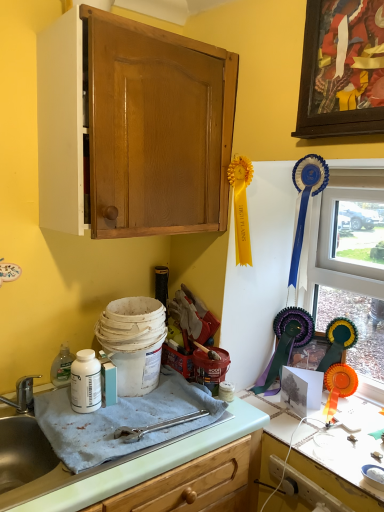
Locate an element on the screen. The height and width of the screenshot is (512, 384). blue ribbon at upper right is located at coordinates (306, 200).

Describe the element at coordinates (334, 470) in the screenshot. This screenshot has height=512, width=384. I see `white glossy countertop at lower right, which appears as the second countertop when viewed from the left` at that location.

What are the coordinates of `clear glass window at right` in the screenshot? It's located at (352, 267).

How distant is wooden picture frame at upper right from light green laminate countertop at lower center, which appears as the second countertop when viewed from the right?

A distance of 1.03 meters exists between wooden picture frame at upper right and light green laminate countertop at lower center, which appears as the second countertop when viewed from the right.

Is wooden picture frame at upper right facing away from light green laminate countertop at lower center, which appears as the second countertop when viewed from the right?

No, wooden picture frame at upper right's orientation is not away from light green laminate countertop at lower center, which appears as the second countertop when viewed from the right.

Considering the points (354, 90) and (123, 473), which point is in front, point (354, 90) or point (123, 473)?

The point (123, 473) is closer to the camera.

Is wooden picture frame at upper right at the right side of light green laminate countertop at lower center, marked as the 1th countertop in a left-to-right arrangement?

Yes, wooden picture frame at upper right is to the right of light green laminate countertop at lower center, marked as the 1th countertop in a left-to-right arrangement.

Is white matte bottle at lower left at the back of white glossy countertop at lower right, which appears as the second countertop when viewed from the left?

white glossy countertop at lower right, which appears as the second countertop when viewed from the left, does not have its back to white matte bottle at lower left.

Considering the sizes of objects white glossy countertop at lower right, which appears as the second countertop when viewed from the left, and white matte bottle at lower left in the image provided, who is bigger, white glossy countertop at lower right, which appears as the second countertop when viewed from the left, or white matte bottle at lower left?

With larger size is white glossy countertop at lower right, which appears as the second countertop when viewed from the left.

This screenshot has height=512, width=384. I want to click on the 2nd countertop located beneath the white matte bottle at lower left (from a real-world perspective), so click(334, 470).

From the image's perspective, relative to blue ribbon at upper right, is light green laminate countertop at lower center, marked as the 1th countertop in a left-to-right arrangement, above or below?

From the image's perspective, light green laminate countertop at lower center, marked as the 1th countertop in a left-to-right arrangement, appears below blue ribbon at upper right.

Based on the photo, is light green laminate countertop at lower center, which appears as the second countertop when viewed from the right, at the right side of blue ribbon at upper right?

No.

Can you tell me how much light green laminate countertop at lower center, marked as the 1th countertop in a left-to-right arrangement, and blue ribbon at upper right differ in facing direction?

86.7 degrees.

Which is closer, (126, 488) or (298, 183)?

Point (126, 488) appears to be closer to the viewer than point (298, 183).

Where is `brush above the light green laminate countertop at lower center, marked as the 1th countertop in a left-to-right arrangement (from a real-world perspective)`? The image size is (384, 512). brush above the light green laminate countertop at lower center, marked as the 1th countertop in a left-to-right arrangement (from a real-world perspective) is located at coordinates (306, 200).

Can you confirm if blue ribbon at upper right is taller than light green laminate countertop at lower center, marked as the 1th countertop in a left-to-right arrangement?

Yes.

Which point is more forward, (323, 178) or (158, 455)?

Positioned in front is point (158, 455).

The height and width of the screenshot is (512, 384). I want to click on cabinetry on the left of clear glass window at right, so click(133, 128).

Can you confirm if clear glass window at right is taller than matte wood cabinet at upper left?

Indeed, clear glass window at right has a greater height compared to matte wood cabinet at upper left.

Between clear glass window at right and matte wood cabinet at upper left, which one has larger width?

Wider between the two is matte wood cabinet at upper left.

Considering the sizes of objects clear glass window at right and matte wood cabinet at upper left in the image provided, who is smaller, clear glass window at right or matte wood cabinet at upper left?

clear glass window at right is smaller.

Consider the image. Which object is further away from the camera taking this photo, white matte bottle at lower left or matte wood cabinet at upper left?

white matte bottle at lower left is more distant.

From the image's perspective, which one is positioned higher, white matte bottle at lower left or matte wood cabinet at upper left?

From the image's view, matte wood cabinet at upper left is above.

From a real-world perspective, who is located higher, white matte bottle at lower left or matte wood cabinet at upper left?

matte wood cabinet at upper left.

Is light green laminate countertop at lower center, marked as the 1th countertop in a left-to-right arrangement, inside the boundaries of white glossy countertop at lower right, which appears as the second countertop when viewed from the left, or outside?

light green laminate countertop at lower center, marked as the 1th countertop in a left-to-right arrangement, lies outside white glossy countertop at lower right, which appears as the second countertop when viewed from the left.

Could you tell me if light green laminate countertop at lower center, marked as the 1th countertop in a left-to-right arrangement, is turned towards white glossy countertop at lower right, positioned as the first countertop in right-to-left order?

No, light green laminate countertop at lower center, marked as the 1th countertop in a left-to-right arrangement, does not turn towards white glossy countertop at lower right, positioned as the first countertop in right-to-left order.

Between point (11, 413) and point (358, 468), which one is positioned behind?

The point (11, 413) is more distant.

Is light green laminate countertop at lower center, marked as the 1th countertop in a left-to-right arrangement, in front of or behind white glossy countertop at lower right, positioned as the first countertop in right-to-left order, in the image?

light green laminate countertop at lower center, marked as the 1th countertop in a left-to-right arrangement, is positioned closer to the viewer than white glossy countertop at lower right, positioned as the first countertop in right-to-left order.

This screenshot has height=512, width=384. There is a wooden picture frame at upper right. Identify the location of the 1st countertop below it (from the image's perspective). (137, 465).

I want to click on bottle behind the white glossy countertop at lower right, positioned as the first countertop in right-to-left order, so click(x=86, y=382).

Looking at this image, which object lies nearer to the anchor point blue ribbon at upper right, wooden picture frame at upper right or clear glass window at right?

wooden picture frame at upper right.

Considering their positions, is white matte bottle at lower left positioned closer to blue ribbon at upper right than clear glass window at right?

clear glass window at right is closer to blue ribbon at upper right.

Estimate the real-world distances between objects in this image. Which object is closer to wooden picture frame at upper right, blue ribbon at upper right or white glossy countertop at lower right, which appears as the second countertop when viewed from the left?

Among the two, blue ribbon at upper right is located nearer to wooden picture frame at upper right.

Which object lies nearer to the anchor point clear glass window at right, light green laminate countertop at lower center, which appears as the second countertop when viewed from the right, or white glossy countertop at lower right, which appears as the second countertop when viewed from the left?

The object closer to clear glass window at right is white glossy countertop at lower right, which appears as the second countertop when viewed from the left.

Looking at the image, which one is located further to matte wood cabinet at upper left, light green laminate countertop at lower center, which appears as the second countertop when viewed from the right, or clear glass window at right?

Based on the image, light green laminate countertop at lower center, which appears as the second countertop when viewed from the right, appears to be further to matte wood cabinet at upper left.

Consider the image. Which object lies further to the anchor point matte wood cabinet at upper left, wooden picture frame at upper right or white glossy countertop at lower right, positioned as the first countertop in right-to-left order?

white glossy countertop at lower right, positioned as the first countertop in right-to-left order, is positioned further to the anchor matte wood cabinet at upper left.

From the image, which object appears to be nearer to light green laminate countertop at lower center, marked as the 1th countertop in a left-to-right arrangement, blue ribbon at upper right or wooden picture frame at upper right?

Among the two, blue ribbon at upper right is located nearer to light green laminate countertop at lower center, marked as the 1th countertop in a left-to-right arrangement.

When comparing their distances from light green laminate countertop at lower center, which appears as the second countertop when viewed from the right, does matte wood cabinet at upper left or blue ribbon at upper right seem further?

matte wood cabinet at upper left is positioned further to the anchor light green laminate countertop at lower center, which appears as the second countertop when viewed from the right.

Where is `brush situated between light green laminate countertop at lower center, which appears as the second countertop when viewed from the right, and white glossy countertop at lower right, which appears as the second countertop when viewed from the left, from left to right`? The height and width of the screenshot is (512, 384). brush situated between light green laminate countertop at lower center, which appears as the second countertop when viewed from the right, and white glossy countertop at lower right, which appears as the second countertop when viewed from the left, from left to right is located at coordinates (306, 200).

Where is `brush between matte wood cabinet at upper left and wooden picture frame at upper right in the horizontal direction`? brush between matte wood cabinet at upper left and wooden picture frame at upper right in the horizontal direction is located at coordinates (306, 200).

Identify the location of countertop between white matte bottle at lower left and blue ribbon at upper right from left to right. The height and width of the screenshot is (512, 384). click(137, 465).

Find the location of `brush between matte wood cabinet at upper left and clear glass window at right in the horizontal direction`. brush between matte wood cabinet at upper left and clear glass window at right in the horizontal direction is located at coordinates (306, 200).